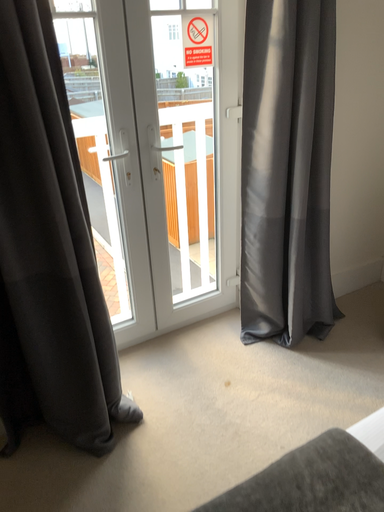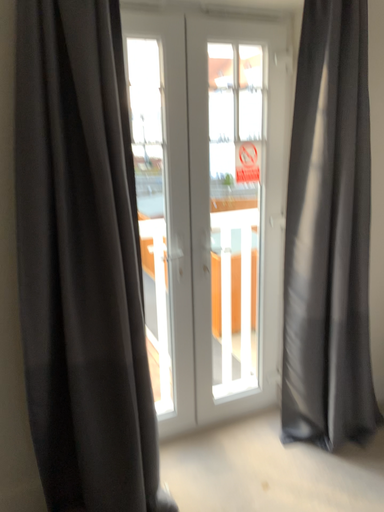
Question: Which way did the camera rotate in the video?

Choices:
 (A) rotated downward
 (B) rotated upward

Answer: (B)